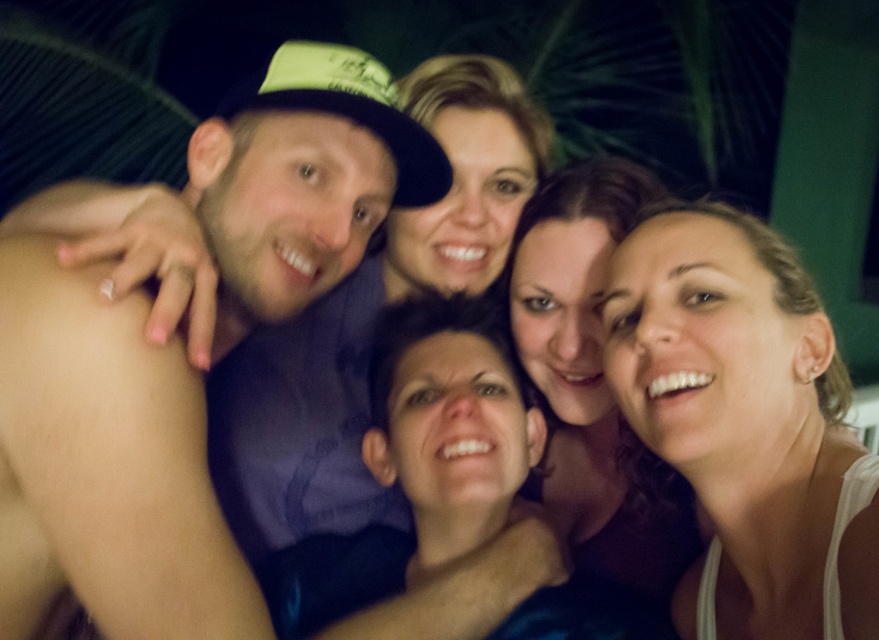
Is matte black hat at upper left smaller than smooth brown hair at center?

No.

Describe the element at coordinates (105, 467) in the screenshot. I see `matte black hat at upper left` at that location.

Where is `matte black hat at upper left`? matte black hat at upper left is located at coordinates (105, 467).

Is matte black hat at upper left below white matte tank top at center?

Incorrect, matte black hat at upper left is not positioned below white matte tank top at center.

Is matte black hat at upper left behind white matte tank top at center?

Yes.

The height and width of the screenshot is (640, 879). What do you see at coordinates (105, 467) in the screenshot? I see `matte black hat at upper left` at bounding box center [105, 467].

The height and width of the screenshot is (640, 879). I want to click on matte black hat at upper left, so pyautogui.click(x=105, y=467).

Measure the distance between white matte tank top at center and camera.

A distance of 60.15 centimeters exists between white matte tank top at center and camera.

Is point (736, 369) less distant than point (572, 525)?

Yes.

Which is in front, point (651, 262) or point (564, 460)?

Point (651, 262) is more forward.

Find the location of a particular element. The height and width of the screenshot is (640, 879). white matte tank top at center is located at coordinates (746, 424).